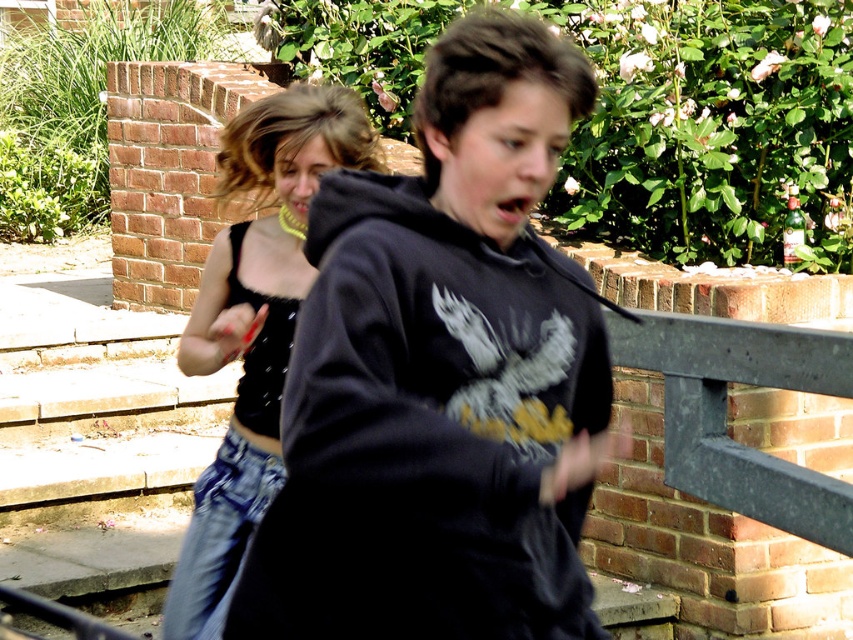
You are a photographer holding a camera. You want to capture a clear photo of the black matte hoodie at center. What is the minimum distance you need to be from the hoodie to ensure it fills the frame properly?

The minimum distance you need to be from the black matte hoodie at center is 2.21 meters to ensure it fills the frame properly.

You are trying to locate the black matte hoodie at center in the image. According to the coordinates provided, where exactly is it positioned?

The black matte hoodie at center is located at point (x=442, y=378).

You are a photographer trying to capture a candid shot of two people moving in the scene. You notice two specific points marked as point 1 at coordinates point (x=503, y=264) and point 2 at coordinates point (x=300, y=86). Which point should you focus on if you want to ensure the subject closest to the camera is in sharp focus?

Point 1 at coordinates point (x=503, y=264) should be focused on because it is closer to the camera than point 2 at coordinates point (x=300, y=86), ensuring the subject nearest to the lens is in focus.